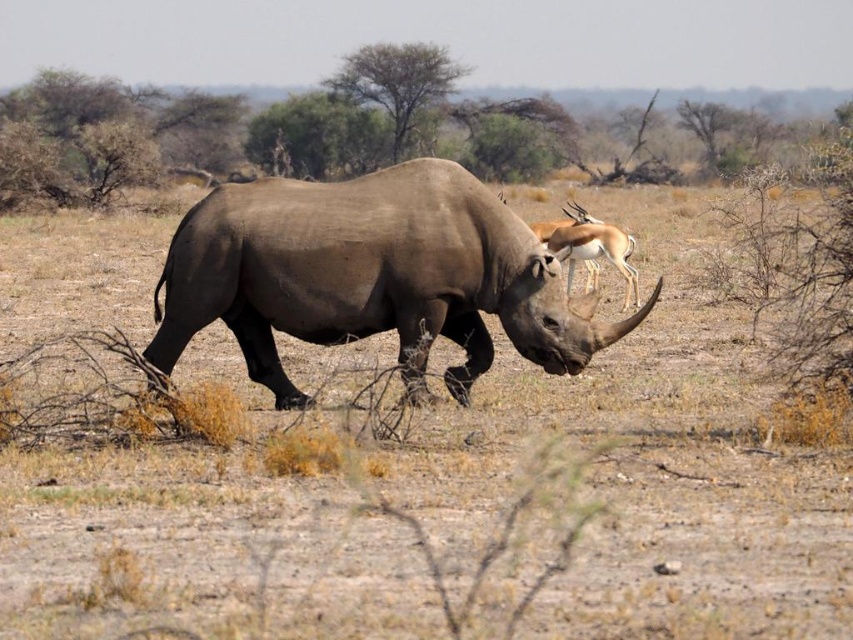
Can you confirm if gray matte rhinoceros at center is bigger than smooth brown antelope at upper right?

Correct, gray matte rhinoceros at center is larger in size than smooth brown antelope at upper right.

The height and width of the screenshot is (640, 853). I want to click on gray matte rhinoceros at center, so click(370, 275).

Locate an element on the screen. The width and height of the screenshot is (853, 640). gray matte rhinoceros at center is located at coordinates (370, 275).